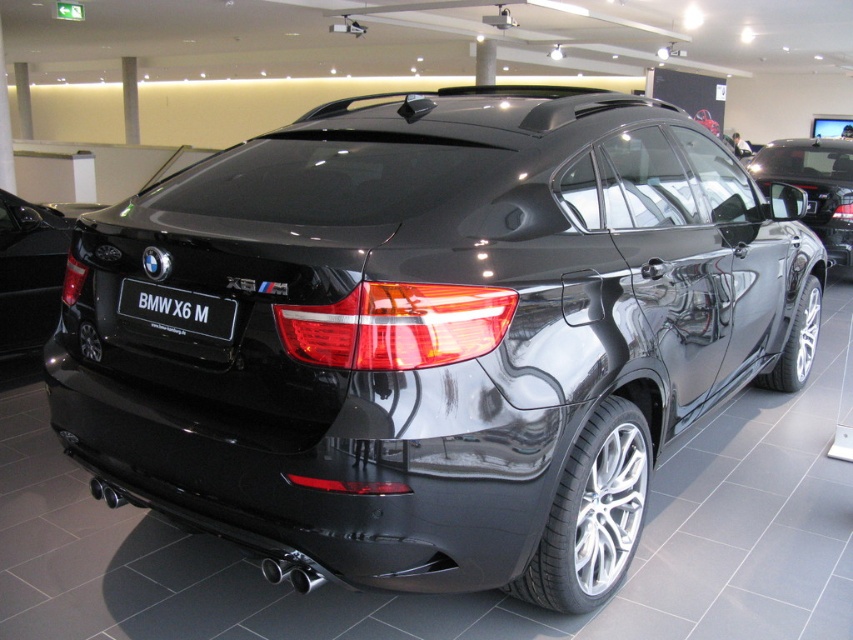
You are a photographer setting up equipment in a showroom. You need to place a light 6 meters away from the black glossy license plate at center to avoid overexposure. Is the glossy black car at right positioned correctly for this setup?

The glossy black car at right is 6.83 meters away from the black glossy license plate at center, which is slightly farther than the required 6 meters. Therefore, the car is positioned correctly to avoid overexposure.

You are a photographer trying to capture the entire glossy black car at center and the black glossy license plate at center in one frame. Given that your camera can only focus on objects up to 1.5 meters in size, will both objects fit in the frame?

The glossy black car at center is bigger than the black glossy license plate at center. Since the car is larger than 1.5 meters, it will not fit within the camera frame that can only focus on objects up to 1.5 meters in size. Therefore, both objects cannot be captured together in one frame.